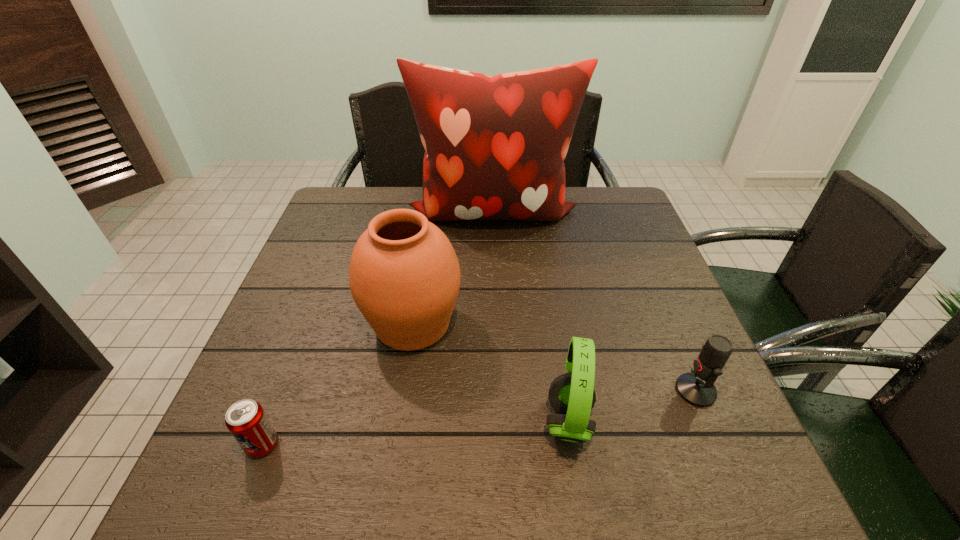
In order to click on free space located on the right of the urn in this screenshot , I will do [x=557, y=323].

Identify the location of vacant space situated 0.170m on the right of the third tallest object. The image size is (960, 540). (684, 421).

Where is `free space located on the side of the microphone with the red ring`? Image resolution: width=960 pixels, height=540 pixels. free space located on the side of the microphone with the red ring is located at coordinates (523, 390).

What are the coordinates of `vacant space located 0.400m on the side of the microphone with the red ring` in the screenshot? It's located at (478, 390).

This screenshot has height=540, width=960. Find the location of `free space located on the side of the microphone with the red ring`. free space located on the side of the microphone with the red ring is located at coordinates (542, 390).

Find the location of `vacant region located 0.390m on the right of the leftmost object`. vacant region located 0.390m on the right of the leftmost object is located at coordinates [492, 444].

Find the location of a particular element. The width and height of the screenshot is (960, 540). object that is at the far edge is located at coordinates (494, 146).

This screenshot has height=540, width=960. I want to click on headset at the near edge, so click(x=572, y=395).

In order to click on soda can at the near edge in this screenshot , I will do `click(246, 420)`.

Image resolution: width=960 pixels, height=540 pixels. Identify the location of object that is at the left edge. (246, 420).